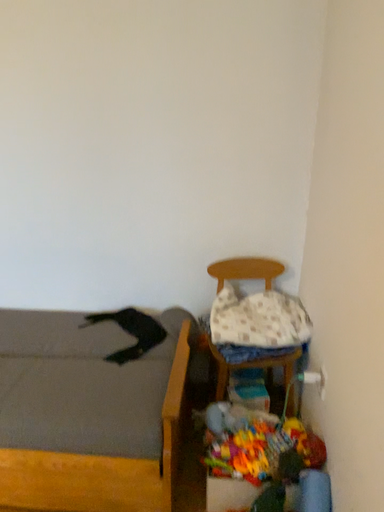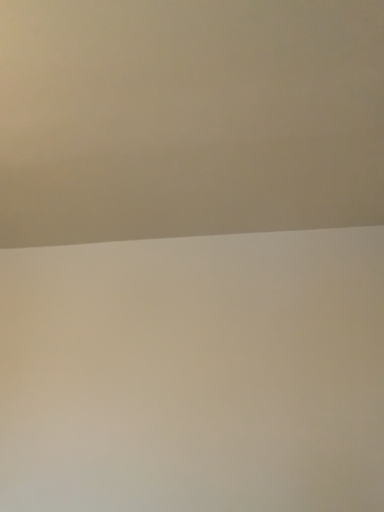
Question: How did the camera likely rotate when shooting the video?

Choices:
 (A) rotated upward
 (B) rotated downward

Answer: (A)